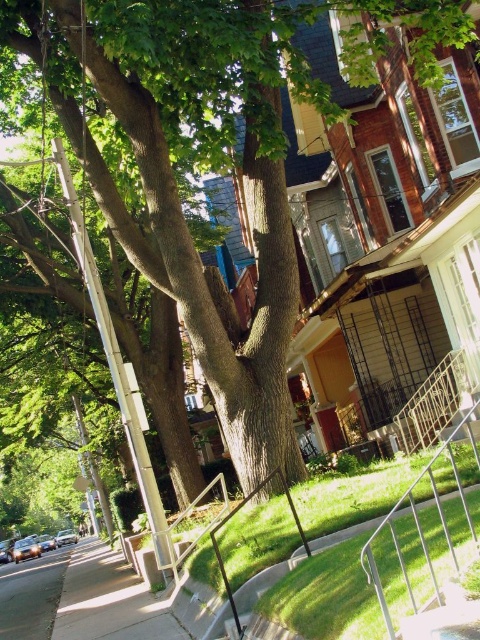
You are a delivery person carrying a heavy package and need to walk from the street to the house. You see the smooth concrete sidewalk at lower left and the green grass at lower right. Which surface would be easier to walk on?

The smooth concrete sidewalk at lower left has a greater height compared to green grass at lower right, so it would be easier to walk on the smooth concrete sidewalk at lower left since it is elevated and provides a solid path.